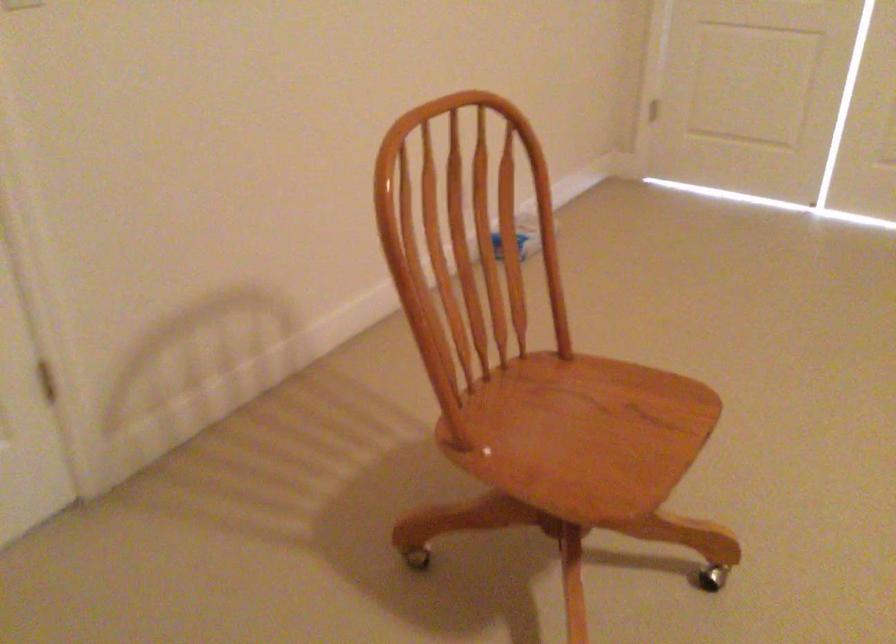
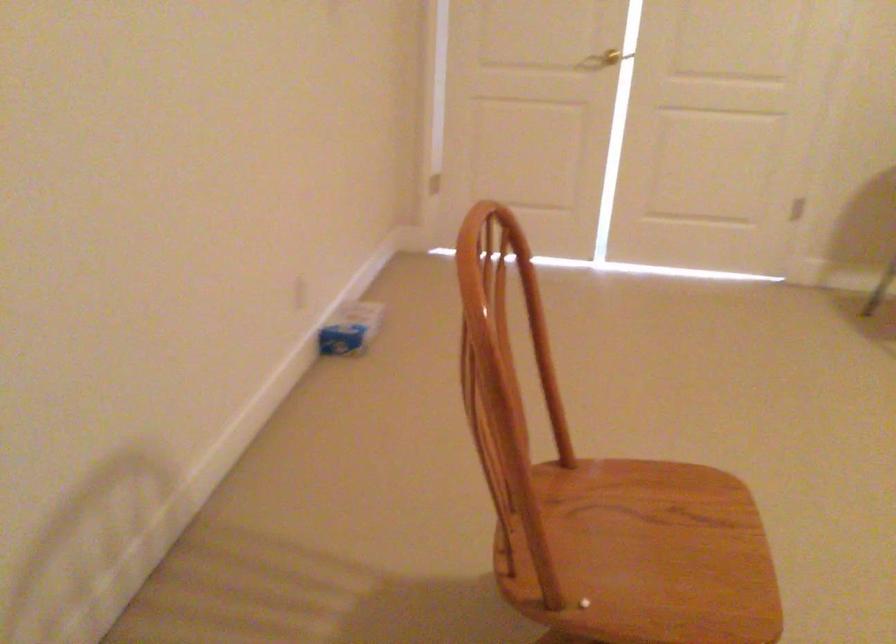
Which direction would the cameraman need to move to produce the second image?

The cameraman walked toward left, forward.